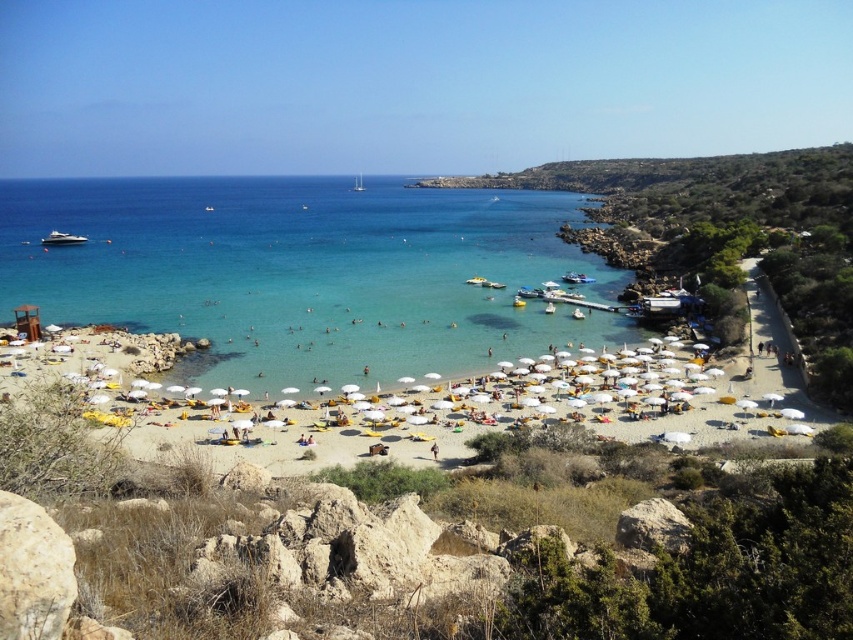
Question: Is clear blue water at center to the left of white glossy boat at left from the viewer's perspective?

Choices:
 (A) yes
 (B) no

Answer: (B)

Question: Can you confirm if clear blue water at center is bigger than white sand at center?

Choices:
 (A) yes
 (B) no

Answer: (A)

Question: Among these points, which one is farthest from the camera?

Choices:
 (A) (57, 241)
 (B) (346, 412)
 (C) (363, 188)

Answer: (C)

Question: Considering the real-world distances, which object is farthest from the white glossy boat at left?

Choices:
 (A) white plastic boat at center
 (B) clear blue water at center
 (C) white sand at center

Answer: (A)

Question: Estimate the real-world distances between objects in this image. Which object is farther from the white glossy boat at left?

Choices:
 (A) clear blue water at center
 (B) white plastic boat at center
 (C) white sand at center

Answer: (B)

Question: Does white glossy boat at left lie in front of white plastic boat at center?

Choices:
 (A) no
 (B) yes

Answer: (B)